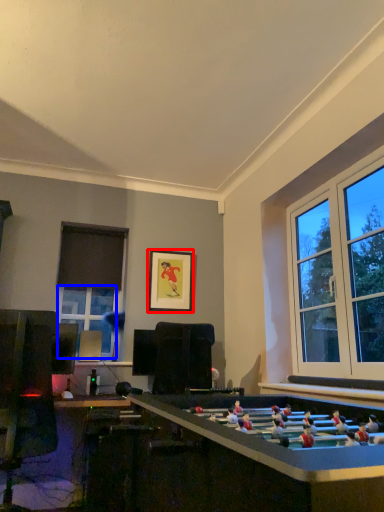
Question: Which object appears closest to the camera in this image, picture frame (highlighted by a red box) or window (highlighted by a blue box)?

Choices:
 (A) picture frame
 (B) window

Answer: (B)